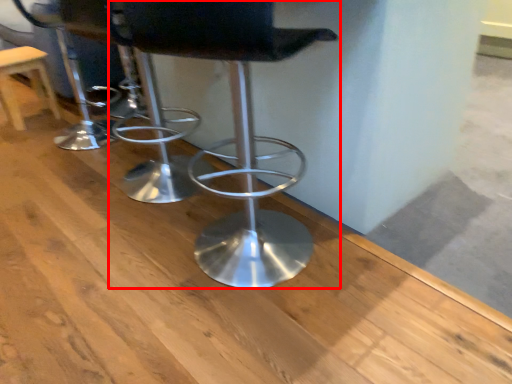
Question: Observing the image, what is the correct spatial positioning of chair (annotated by the red box) in reference to stool?

Choices:
 (A) right
 (B) left

Answer: (A)